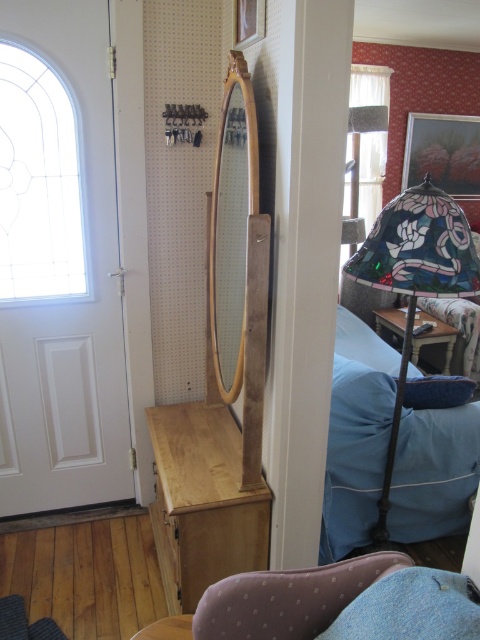
Looking at this image, does stained glass lampshade at right have a lesser height compared to wooden mirror at center?

Incorrect, stained glass lampshade at right's height does not fall short of wooden mirror at center's.

The height and width of the screenshot is (640, 480). Describe the element at coordinates (414, 280) in the screenshot. I see `stained glass lampshade at right` at that location.

I want to click on stained glass lampshade at right, so click(414, 280).

Can you confirm if stained glass lampshade at right is positioned to the left of blue fabric pillow at lower right?

Indeed, stained glass lampshade at right is positioned on the left side of blue fabric pillow at lower right.

Is point (373, 529) farther from viewer compared to point (460, 387)?

Yes, point (373, 529) is behind point (460, 387).

Is point (376, 531) positioned in front of point (456, 404)?

Yes, it is.

Locate an element on the screen. stained glass lampshade at right is located at coordinates tap(414, 280).

Between wooden mirror at center and blue fabric pillow at lower right, which one appears on the right side from the viewer's perspective?

Positioned to the right is blue fabric pillow at lower right.

Is wooden mirror at center shorter than blue fabric pillow at lower right?

No, wooden mirror at center is not shorter than blue fabric pillow at lower right.

Describe the element at coordinates (231, 225) in the screenshot. I see `wooden mirror at center` at that location.

Identify the location of wooden mirror at center. (231, 225).